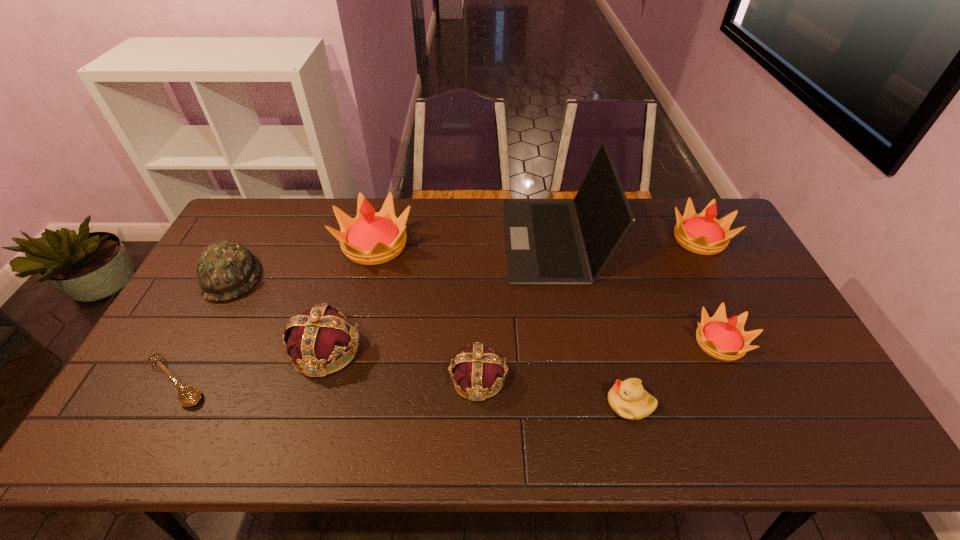
This screenshot has width=960, height=540. I want to click on yellow duckling, so click(628, 399).

Find the location of a particular element. the shortest object is located at coordinates (188, 396).

Where is `vacant space located on the screen of the laptop`? vacant space located on the screen of the laptop is located at coordinates (456, 240).

You are a GUI agent. You are given a task and a screenshot of the screen. Output one action in this format:
    pyautogui.click(x=<x>, y=<y>)
    Task: Click on the vacant space located on the screen of the laptop
    The width and height of the screenshot is (960, 540).
    Given the screenshot: What is the action you would take?
    pyautogui.click(x=416, y=240)

What are the coordinates of `vacant space situated 0.230m on the screen of the laptop` in the screenshot? It's located at (439, 240).

This screenshot has height=540, width=960. In order to click on blank area located 0.110m on the right of the tallest crown in this screenshot , I will do `click(444, 245)`.

Locate an element on the screen. Image resolution: width=960 pixels, height=540 pixels. vacant space situated 0.070m on the left of the second biggest yellow crown is located at coordinates (648, 239).

The height and width of the screenshot is (540, 960). Identify the location of blank space located on the back of the left purple crown. (345, 288).

Locate an element on the screen. This screenshot has width=960, height=540. vacant space located on the left of the nearest yellow crown is located at coordinates (617, 342).

Find the location of a particular element. vacant region located on the front of the headwear is located at coordinates (165, 397).